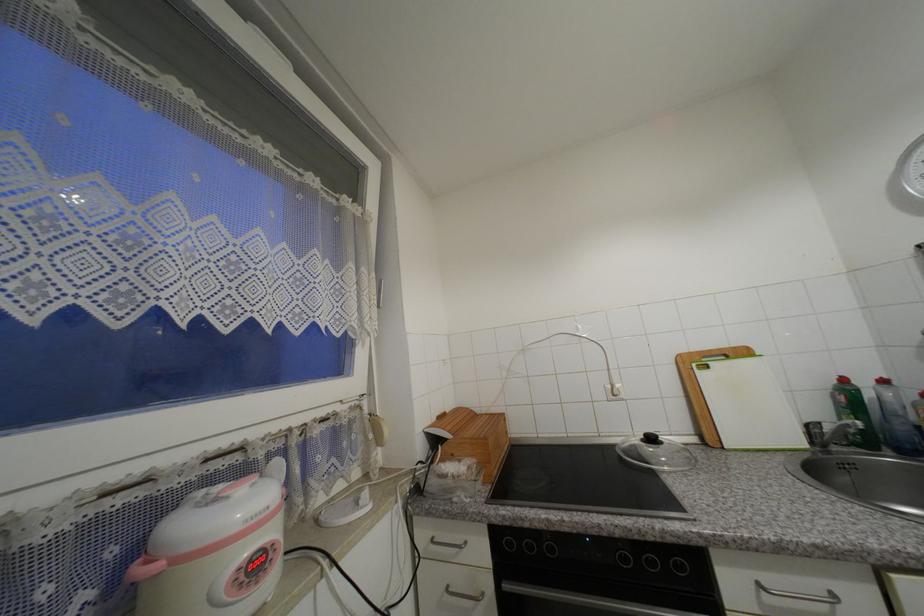
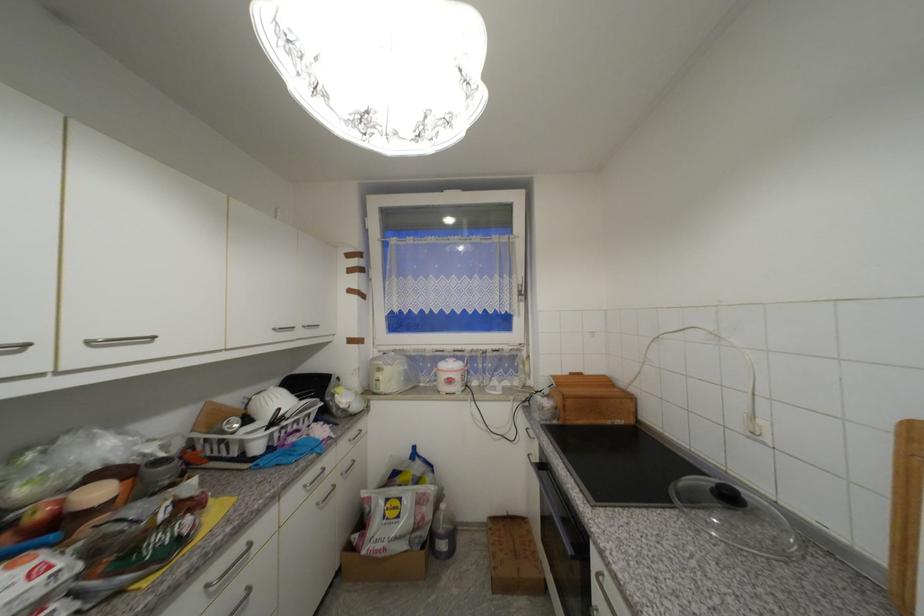
Find the pixel in the second image that matches point (262, 567) in the first image.

(456, 382)